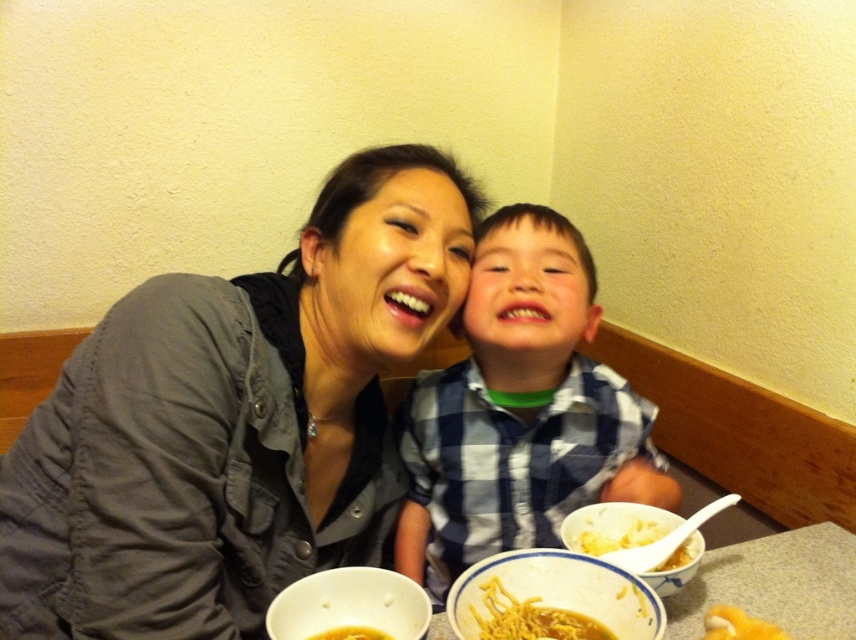
Question: Estimate the real-world distances between objects in this image. Which object is closer to the yellow noodle soup at lower center?

Choices:
 (A) yellow matte bowl at lower center
 (B) denim jacket at center

Answer: (A)

Question: From the image, what is the correct spatial relationship of blue plaid shirt at center in relation to yellow noodle soup at lower center?

Choices:
 (A) below
 (B) above

Answer: (B)

Question: Which of the following is the closest to the observer?

Choices:
 (A) blue plaid shirt at center
 (B) denim jacket at center

Answer: (B)

Question: Is yellow matte bowl at lower center behind white matte bowl at lower center?

Choices:
 (A) no
 (B) yes

Answer: (B)

Question: Which of these objects is positioned farthest from the denim jacket at center?

Choices:
 (A) yellow matte bowl at lower center
 (B) yellow matte noodles at lower center
 (C) yellow noodle soup at lower center
 (D) yellow matte soup at lower center

Answer: (B)

Question: Does white matte bowl at lower center appear on the left side of yellow matte noodles at lower center?

Choices:
 (A) no
 (B) yes

Answer: (B)